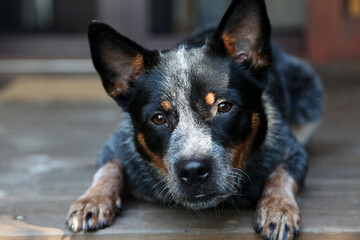
At what (x,y) coordinates should I click in order to perform the action: click on edge of table far right. Please return your answer as a coordinate pair (x, y). This screenshot has height=240, width=360. Looking at the image, I should click on (342, 230).